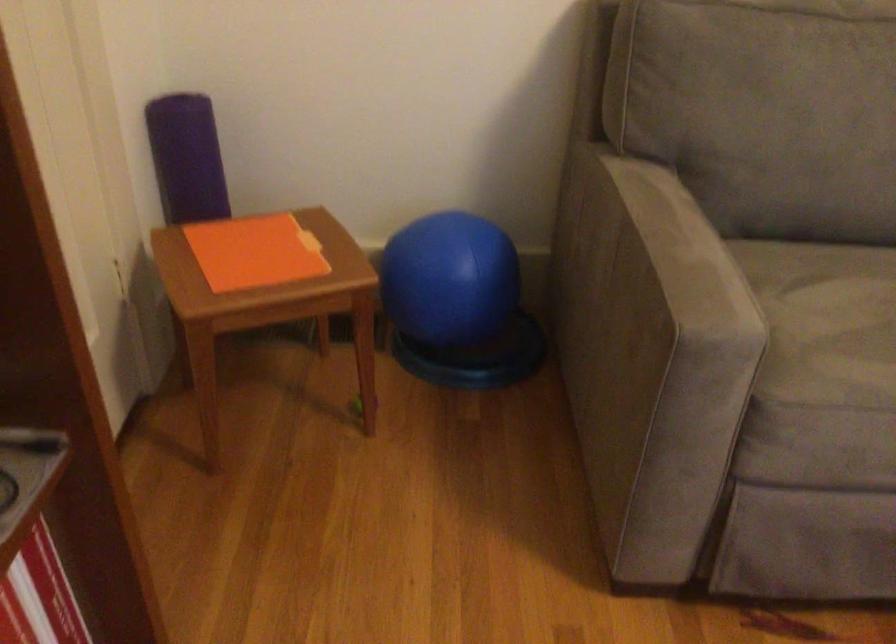
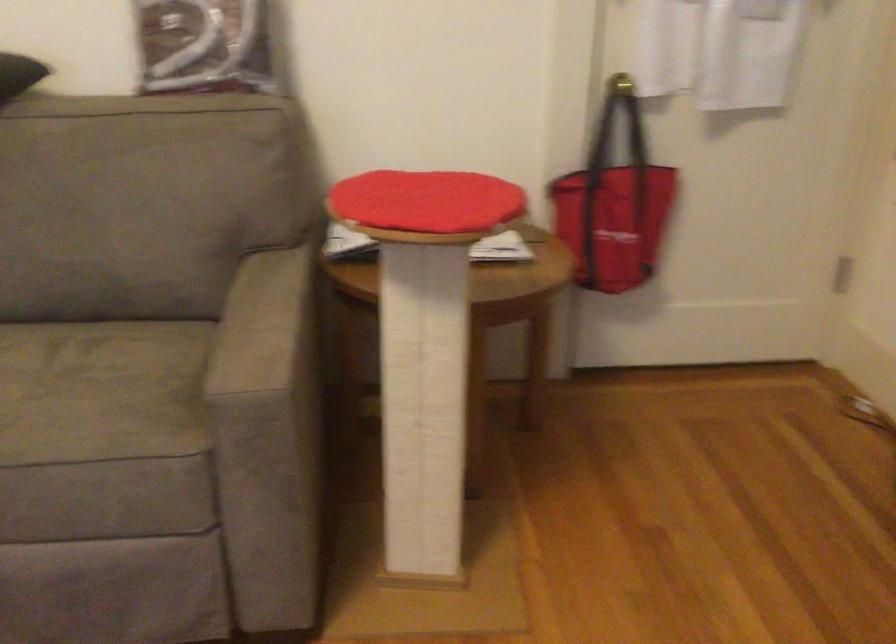
Question: Which direction would the cameraman need to move to produce the second image? Reply with the corresponding letter.

Choices:
 (A) Left
 (B) Right
 (C) Forward
 (D) Backward

Answer: (B)